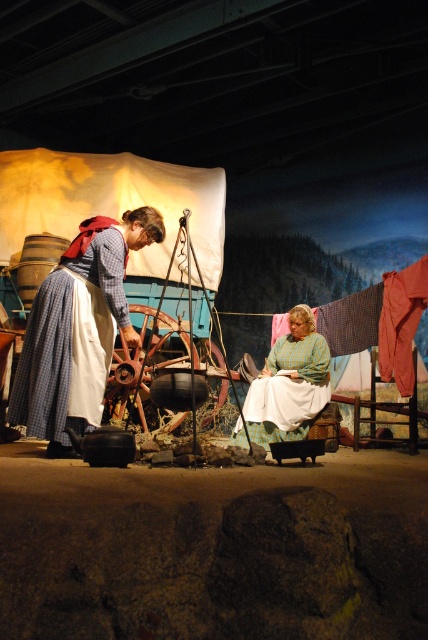
You are standing in the historical reenactment scene and want to approach the blue plaid dress at left and the green plaid dress at center. Which dress should you walk towards first to reach the one closer to you?

You should walk towards the blue plaid dress at left first because it is closer to you than the green plaid dress at center.

You are a visitor standing in the museum exhibit and want to take a photo of the blue plaid dress at left. If your camera has a maximum focus range of 10 feet, will you need to move closer to capture the dress clearly?

The blue plaid dress at left is 11.43 feet away from the viewer. Since the camera can only focus up to 10 feet, you need to move closer to ensure the dress is in focus.